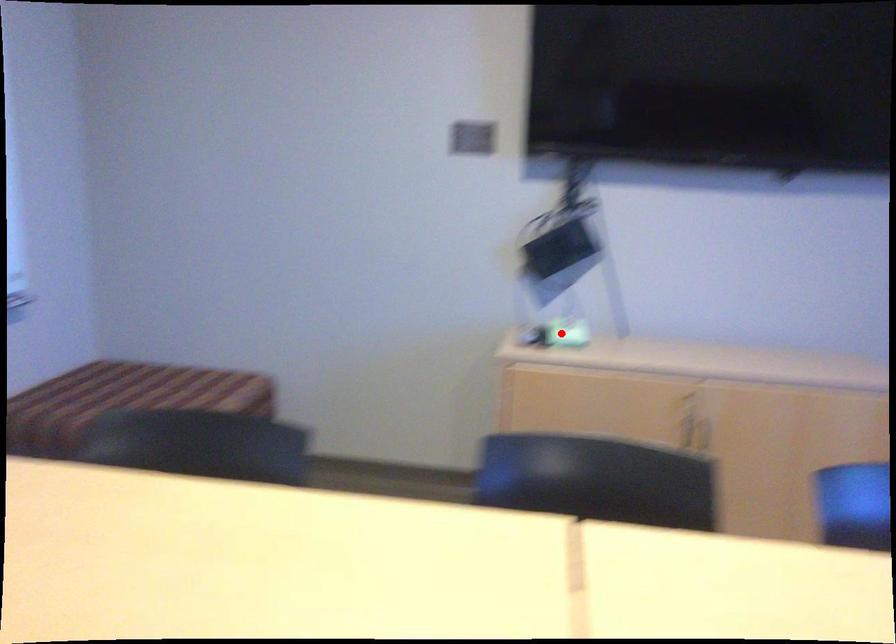
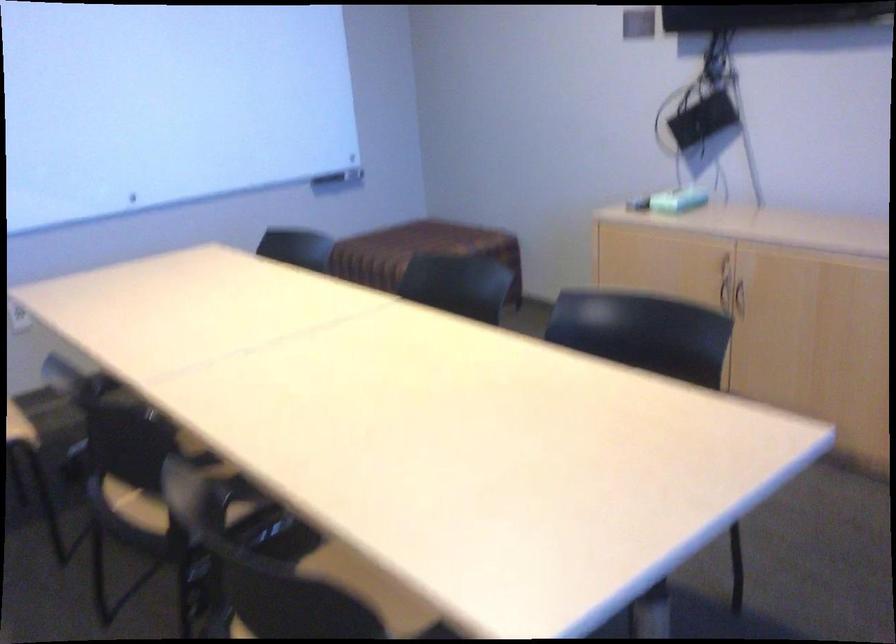
Where in the second image is the point corresponding to the highlighted location from the first image?

(677, 200)